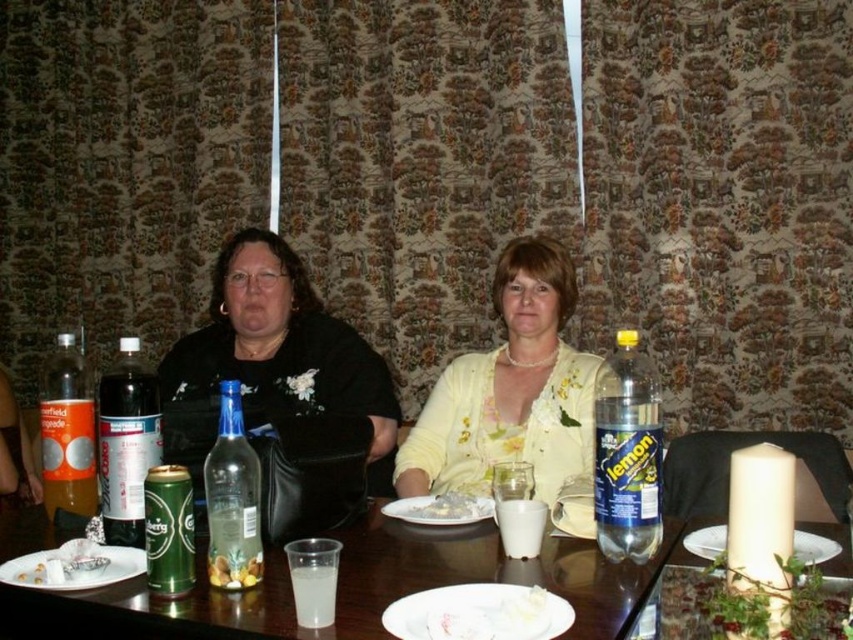
Which is more to the right, black fabric at center or clear glass bottle at center?

From the viewer's perspective, clear glass bottle at center appears more on the right side.

Is black fabric at center further to camera compared to clear glass bottle at center?

That is True.

I want to click on black fabric at center, so click(282, 349).

Image resolution: width=853 pixels, height=640 pixels. Identify the location of blue plastic bottle at right. (627, 452).

Does point (650, 365) come in front of point (514, 627)?

No, (650, 365) is further to viewer.

Is point (602, 378) in front of point (477, 605)?

No.

This screenshot has width=853, height=640. In order to click on blue plastic bottle at right in this screenshot , I will do `click(627, 452)`.

Can you confirm if white ceramic plate at lower right is thinner than yellow matte nuts at center?

Incorrect, white ceramic plate at lower right's width is not less than yellow matte nuts at center's.

Is point (695, 529) in front of point (259, 554)?

No, (695, 529) is further to viewer.

Identify the location of white ceramic plate at lower right. Image resolution: width=853 pixels, height=640 pixels. click(x=813, y=547).